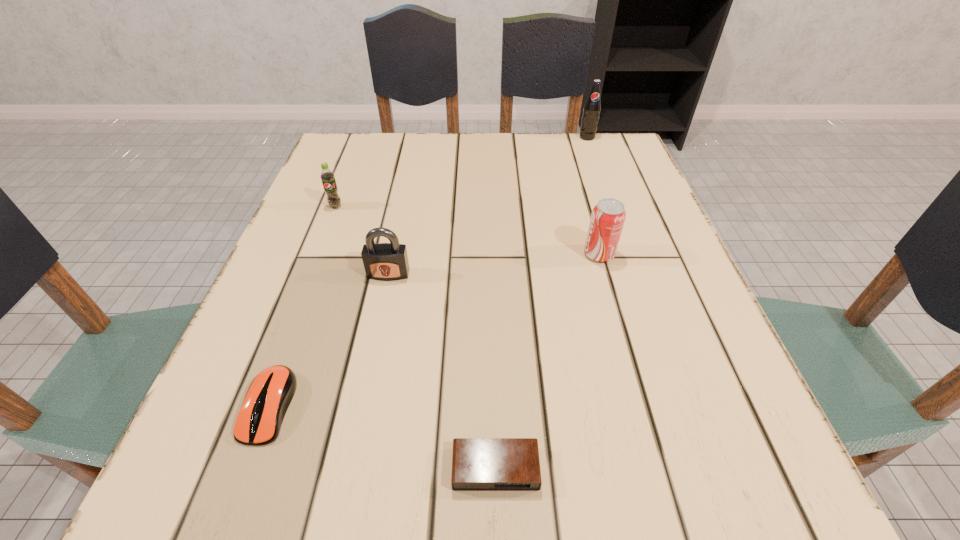
The height and width of the screenshot is (540, 960). I want to click on soda that is positioned at the left edge, so click(x=327, y=176).

Locate an element on the screen. This screenshot has width=960, height=540. computer mouse located in the left edge section of the desktop is located at coordinates (269, 395).

Locate an element on the screen. The height and width of the screenshot is (540, 960). object that is at the far right corner is located at coordinates (592, 107).

Image resolution: width=960 pixels, height=540 pixels. Find the location of `free space at the far edge of the desktop`. free space at the far edge of the desktop is located at coordinates (426, 146).

In the image, there is a desktop. Where is `vacant space at the near edge`? vacant space at the near edge is located at coordinates (333, 496).

Identify the location of vacant position at the left edge of the desktop. (321, 225).

Where is `vacant position at the right edge of the desktop`? This screenshot has width=960, height=540. vacant position at the right edge of the desktop is located at coordinates (666, 331).

Locate an element on the screen. Image resolution: width=960 pixels, height=540 pixels. blank area at the far right corner is located at coordinates (605, 151).

The height and width of the screenshot is (540, 960). In order to click on vacant space at the near right corner in this screenshot , I will do `click(731, 487)`.

Where is `unoccupied area between the second farthest object and the fourth farthest object`? This screenshot has width=960, height=540. unoccupied area between the second farthest object and the fourth farthest object is located at coordinates (362, 240).